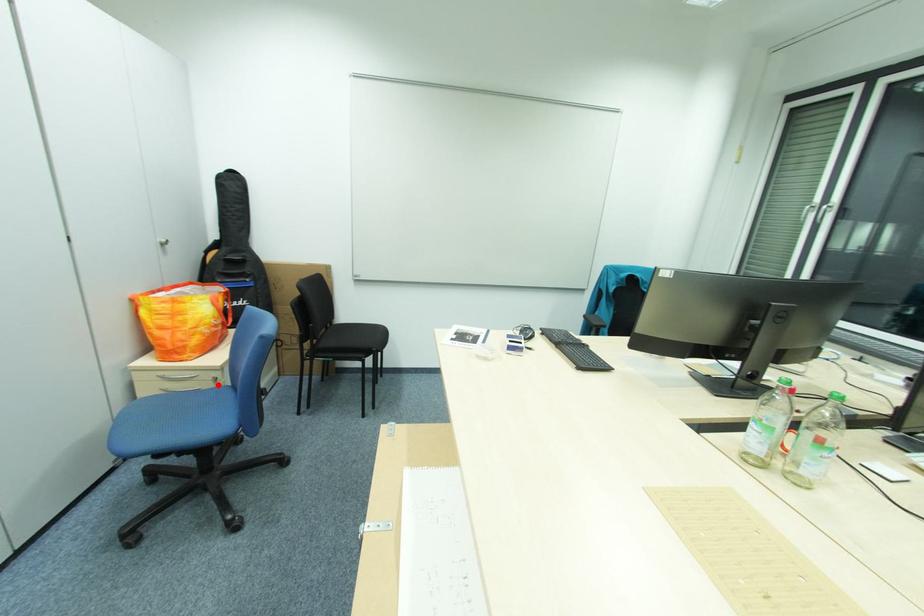
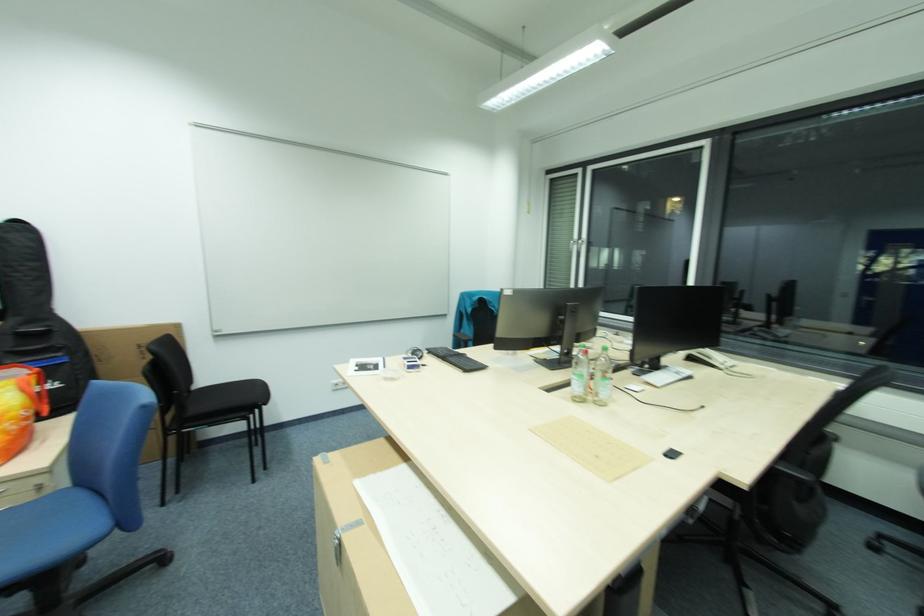
Question: A red point is marked in image1. In image2, is the corresponding 3D point closer to the camera or farther? Reply with the corresponding letter.

Choices:
 (A) The corresponding 3D point is closer.
 (B) The corresponding 3D point is farther.

Answer: (A)